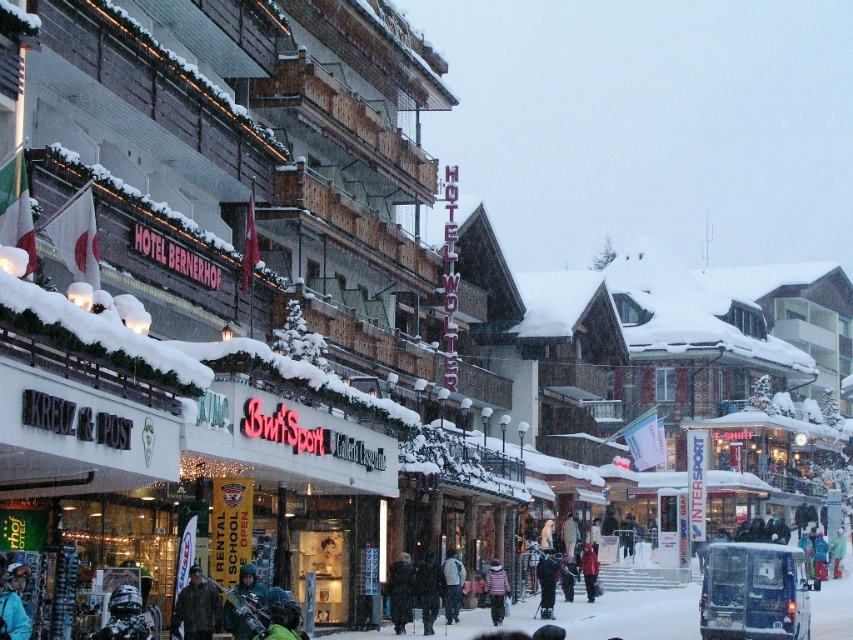
You are standing in the snowy street scene and want to take a photo of both the Hotel Bernerhof and Hotel Wolter signs. You notice two points marked on your map at coordinates point (392, 602) and point (428, 563). Which point should you stand closer to ensure both signs are in frame?

You should stand closer to point (392, 602) because it is closer to the camera, allowing both signs to be in frame more effectively.

You are a photographer standing in the snowy street scene and want to take a photo of both the black fur coat at center and the white fleece jacket at center. Which one should you focus on first to ensure both are in sharp focus?

The black fur coat at center is closer to the viewer than the white fleece jacket at center, so you should focus on the black fur coat at center first to ensure both are in sharp focus.

You are standing at the center of the snowy street scene in front of the traditional European ski resort town buildings. You notice two points marked on the image. The first point is at coordinates point (402,604), and the second point is at coordinates point (447,589). Which of these two points is closer to your current position?

Point (402,604) is closer to the camera than point (447,589), so the first point is closer to your current position.